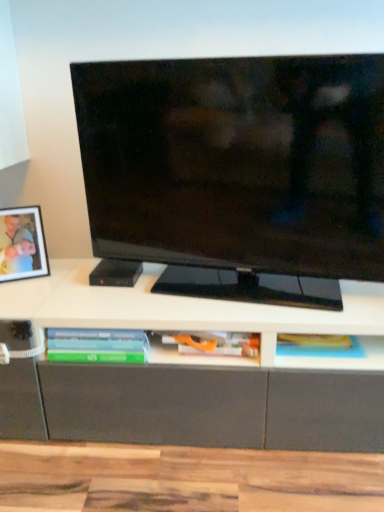
Where is `free space above translucent plastic book at lower center, the 2th book viewed from the right (from a real-world perspective)`? free space above translucent plastic book at lower center, the 2th book viewed from the right (from a real-world perspective) is located at coordinates (94, 326).